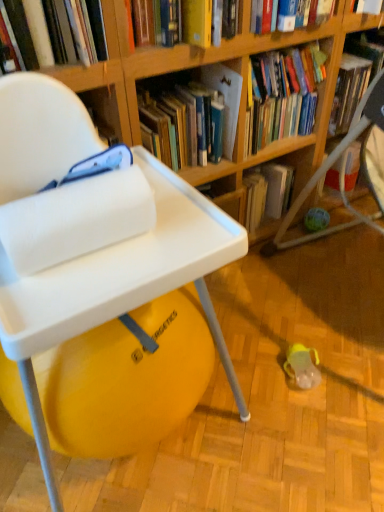
Locate an element on the screen. vacant space to the right of white plastic chair at left is located at coordinates (287, 388).